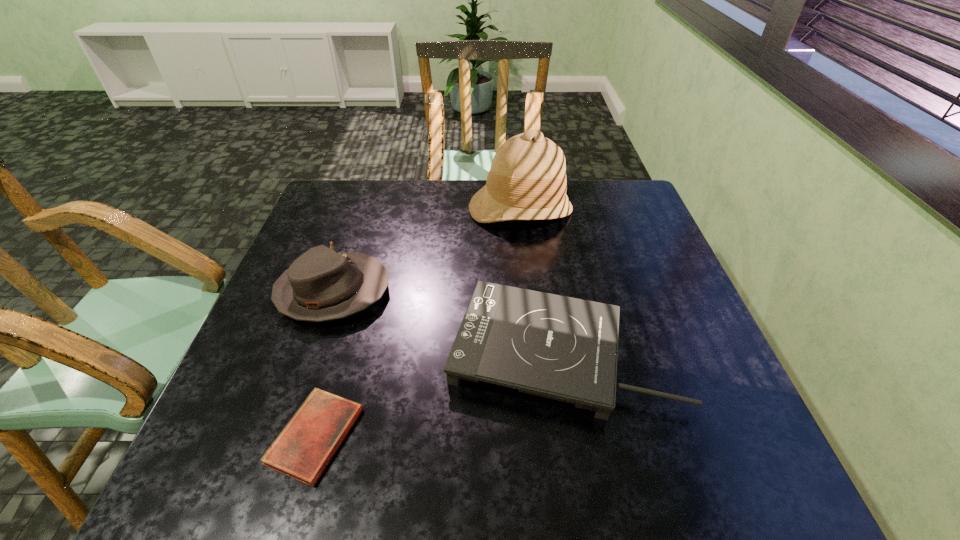
Where is `vacant position in the image that satisfies the following two spatial constraints: 1. on the decorative side of the third shortest object; 2. on the back side of the shortest object`? vacant position in the image that satisfies the following two spatial constraints: 1. on the decorative side of the third shortest object; 2. on the back side of the shortest object is located at coordinates (283, 436).

Image resolution: width=960 pixels, height=540 pixels. Find the location of `vacant region that satisfies the following two spatial constraints: 1. on the decorative side of the shorter hat; 2. on the left side of the second shortest object`. vacant region that satisfies the following two spatial constraints: 1. on the decorative side of the shorter hat; 2. on the left side of the second shortest object is located at coordinates pos(312,351).

This screenshot has height=540, width=960. Identify the location of free location that satisfies the following two spatial constraints: 1. on the decorative side of the hotplate; 2. on the right side of the third shortest object. (312, 351).

Locate an element on the screen. The image size is (960, 540). free space in the image that satisfies the following two spatial constraints: 1. on the back side of the diary; 2. on the decorative side of the nearer hat is located at coordinates (357, 292).

The image size is (960, 540). Find the location of `free point that satisfies the following two spatial constraints: 1. on the decorative side of the left hat; 2. on the left side of the second shortest object`. free point that satisfies the following two spatial constraints: 1. on the decorative side of the left hat; 2. on the left side of the second shortest object is located at coordinates (312, 351).

I want to click on free space in the image that satisfies the following two spatial constraints: 1. on the decorative side of the shorter hat; 2. on the back side of the hotplate, so click(x=312, y=351).